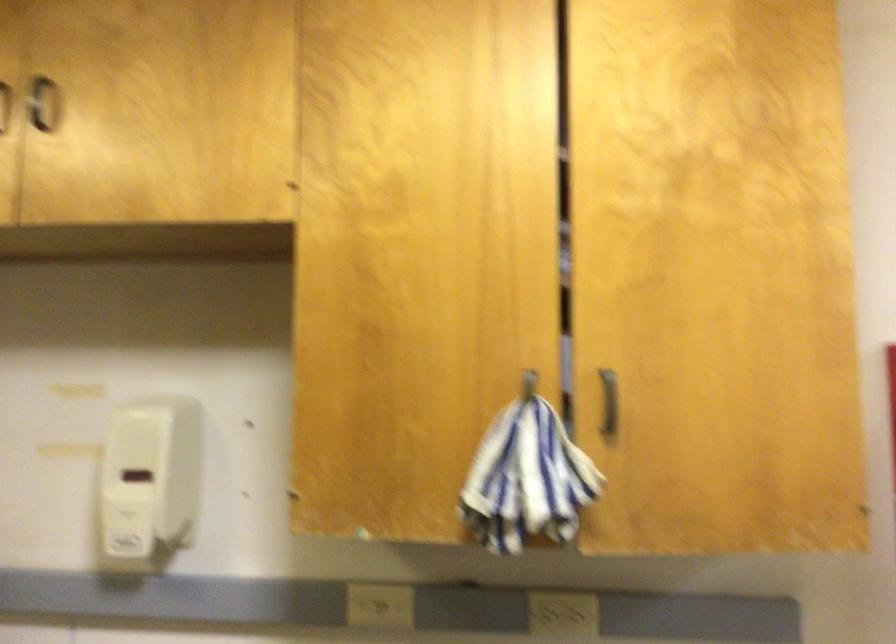
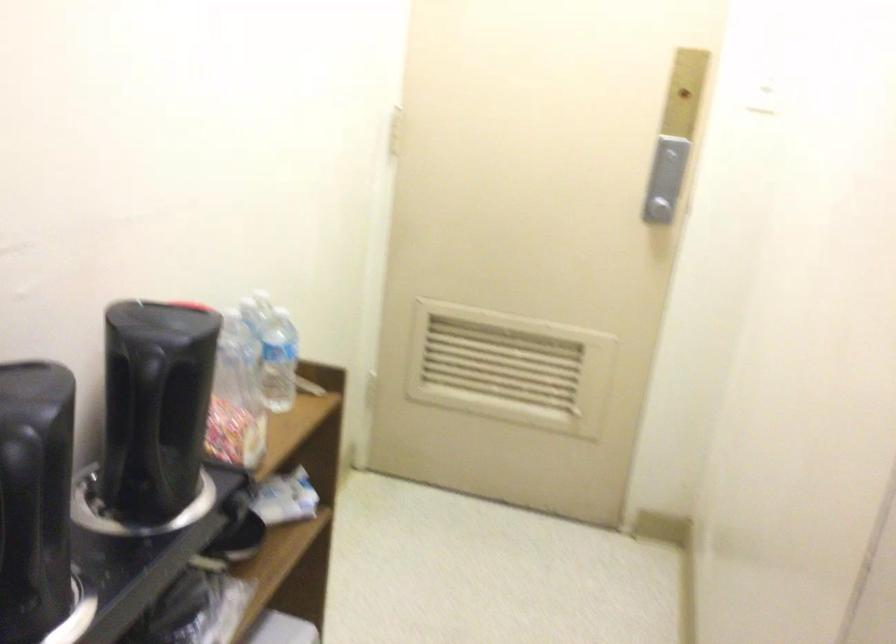
The images are taken continuously from a first-person perspective. In which direction is your viewpoint rotating?

The camera rotated toward right-down.